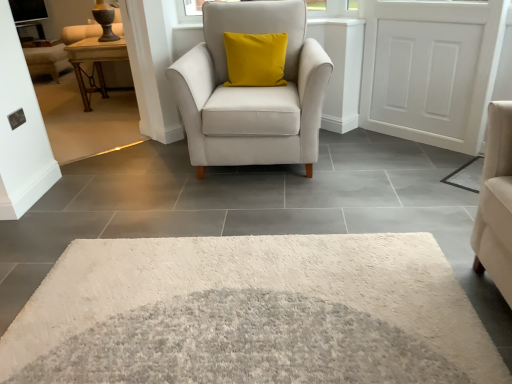
Question: In the image, is white shaggy rug at lower right positioned in front of or behind transparent glass window screen at upper left?

Choices:
 (A) front
 (B) behind

Answer: (A)

Question: Does point (472, 175) appear closer or farther from the camera than point (16, 8)?

Choices:
 (A) farther
 (B) closer

Answer: (B)

Question: Estimate the real-world distances between objects in this image. Which object is farther from the woodenwoodentable at left?

Choices:
 (A) white shaggy rug at lower right
 (B) white wood door at upper right
 (C) matte white armchair at center
 (D) transparent glass window screen at upper left
 (E) matte brown wooden couch at upper left

Answer: (A)

Question: Considering the real-world distances, which object is farthest from the matte white armchair at center?

Choices:
 (A) transparent glass window screen at upper left
 (B) white shaggy rug at lower right
 (C) matte brown wooden couch at upper left
 (D) white wood door at upper right
 (E) woodenwoodentable at left

Answer: (A)